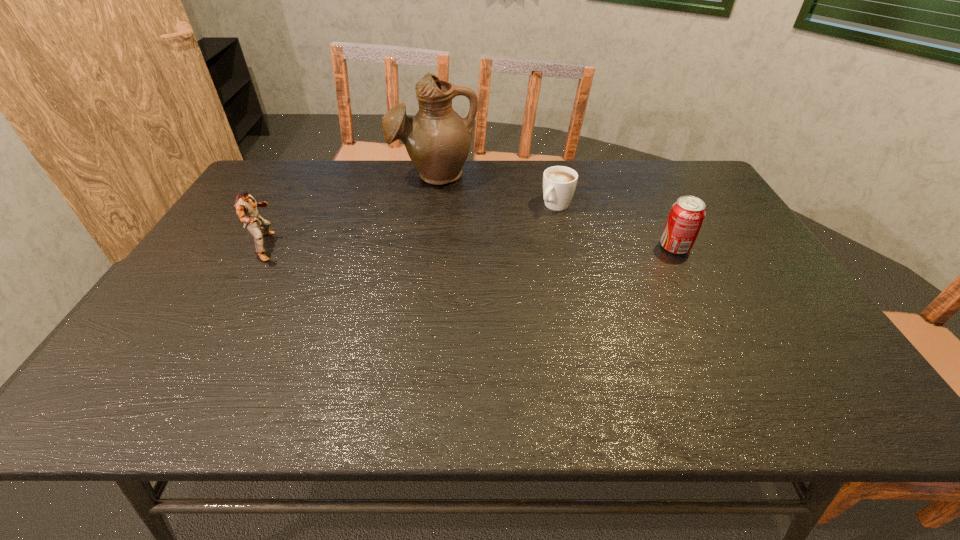
This screenshot has width=960, height=540. I want to click on free space at the near edge of the desktop, so click(432, 359).

The image size is (960, 540). What are the coordinates of `free spot at the left edge of the desktop` in the screenshot? It's located at (174, 318).

The width and height of the screenshot is (960, 540). In the image, there is a desktop. In order to click on free region at the right edge in this screenshot , I will do `click(731, 210)`.

Image resolution: width=960 pixels, height=540 pixels. I want to click on vacant space at the near left corner of the desktop, so click(177, 353).

You are a GUI agent. You are given a task and a screenshot of the screen. Output one action in this format:
    pyautogui.click(x=<x>, y=<y>)
    Task: Click on the free spot at the far right corner of the desktop
    The width and height of the screenshot is (960, 540).
    Given the screenshot: What is the action you would take?
    pyautogui.click(x=704, y=174)

In order to click on vacant area that lies between the soda and the second farthest object in this screenshot , I will do `click(615, 226)`.

Locate an element on the screen. This screenshot has width=960, height=540. vacant space in between the leftmost object and the third object from right to left is located at coordinates (350, 211).

Locate an element on the screen. free space between the cappuccino and the third tallest object is located at coordinates (615, 226).

Where is `vacant region between the rightmost object and the leftmost object`? vacant region between the rightmost object and the leftmost object is located at coordinates (470, 247).

Where is `free space between the third nearest object and the second shortest object`? The width and height of the screenshot is (960, 540). free space between the third nearest object and the second shortest object is located at coordinates (615, 226).